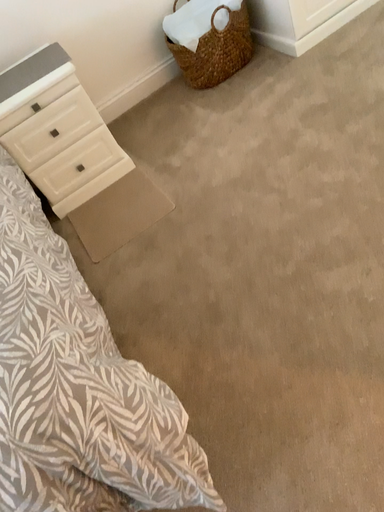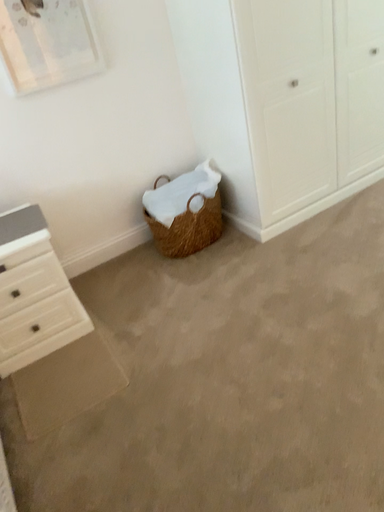
Question: How did the camera likely rotate when shooting the video?

Choices:
 (A) rotated right
 (B) rotated left

Answer: (A)